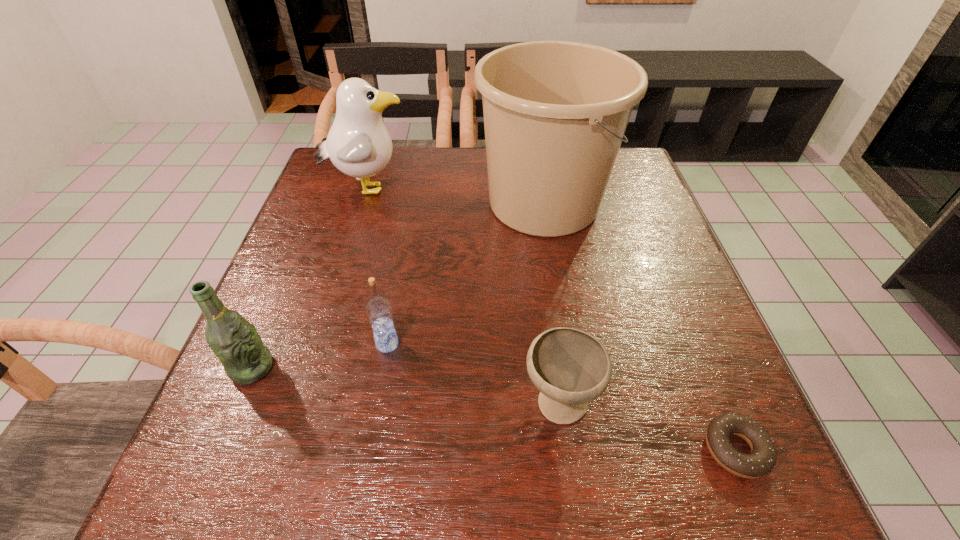
The height and width of the screenshot is (540, 960). Identify the location of vacant region located 0.150m on the back of the vodka. (399, 279).

Image resolution: width=960 pixels, height=540 pixels. I want to click on vacant space located 0.190m on the back of the chalice, so click(544, 293).

What are the coordinates of `free location located on the left of the doughnut` in the screenshot? It's located at (534, 449).

At what (x,y) coordinates should I click in order to perform the action: click on bucket located in the far edge section of the desktop. Please return your answer as a coordinate pair (x, y). The width and height of the screenshot is (960, 540). Looking at the image, I should click on (555, 113).

The image size is (960, 540). In order to click on gull located at the far edge in this screenshot , I will do `click(358, 144)`.

Where is `object at the near edge`? object at the near edge is located at coordinates (762, 459).

Locate an element on the screen. This screenshot has height=540, width=960. gull that is at the left edge is located at coordinates (358, 144).

At what (x,y) coordinates should I click in order to perform the action: click on beer bottle located in the left edge section of the desktop. Please return your answer as a coordinate pair (x, y). Looking at the image, I should click on (x=235, y=341).

Find the location of `bucket located in the right edge section of the desktop`. bucket located in the right edge section of the desktop is located at coordinates (555, 113).

The height and width of the screenshot is (540, 960). Identify the location of doughnut located in the right edge section of the desktop. (762, 459).